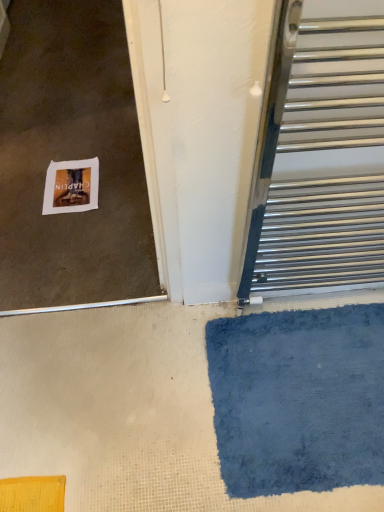
Locate an element on the screen. This screenshot has width=384, height=512. free space that is to the left of blue plush bath mat at lower right is located at coordinates (129, 396).